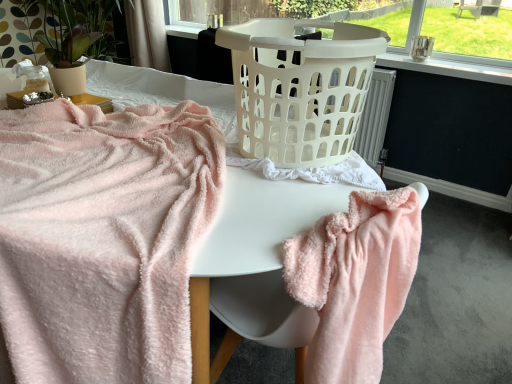
Measure the distance between point (318,376) and camera.

Point (318,376) and camera are 35.55 inches apart.

Locate an element on the screen. The image size is (512, 384). fluffy pink towel at lower right, placed as the second towel when sorted from left to right is located at coordinates (355, 281).

The image size is (512, 384). Describe the element at coordinates (147, 34) in the screenshot. I see `white sheer curtain at upper center` at that location.

The width and height of the screenshot is (512, 384). What are the coordinates of `soft pink plush towel at left, arranged as the second towel when viewed from the right` in the screenshot? It's located at (103, 238).

The width and height of the screenshot is (512, 384). Describe the element at coordinates (300, 88) in the screenshot. I see `white plastic laundry basket at center` at that location.

What do you see at coordinates (75, 29) in the screenshot?
I see `matte beige pot at upper left` at bounding box center [75, 29].

Locate an element on the screen. matte pink blanket at center is located at coordinates (264, 218).

Where is `white plastic laundry basket at center`? white plastic laundry basket at center is located at coordinates (259, 317).

From the image's perspective, is matte beige pot at upper left positioned above or below white plastic laundry basket at center?

matte beige pot at upper left is above white plastic laundry basket at center.

Is matte beige pot at upper left not near white plastic laundry basket at center?

Yes, matte beige pot at upper left and white plastic laundry basket at center are located far from each other.

From a real-world perspective, which object stands above the other?

matte beige pot at upper left.

Do you think white plastic laundry basket at center is within matte beige pot at upper left, or outside of it?

white plastic laundry basket at center is spatially situated outside matte beige pot at upper left.

Considering their positions, is white plastic laundry basket at center located in front of or behind matte beige pot at upper left?

Clearly, white plastic laundry basket at center is in front of matte beige pot at upper left.

Between white plastic laundry basket at center and matte beige pot at upper left, which one appears on the right side from the viewer's perspective?

white plastic laundry basket at center.

From the image's perspective, which one is positioned lower, white plastic laundry basket at center or matte beige pot at upper left?

white plastic laundry basket at center appears lower in the image.

Consider the image. From a real-world perspective, relative to fluffy pink towel at lower right, which appears as the 1th towel when viewed from the right, is white plastic laundry basket at upper center vertically above or below?

white plastic laundry basket at upper center is above fluffy pink towel at lower right, which appears as the 1th towel when viewed from the right.

How distant is white plastic laundry basket at upper center from fluffy pink towel at lower right, placed as the second towel when sorted from left to right?

1.92 meters.

How many degrees apart are the facing directions of white plastic laundry basket at upper center and fluffy pink towel at lower right, which appears as the 1th towel when viewed from the right?

86.2 degrees.

Considering the positions of objects white plastic laundry basket at upper center and fluffy pink towel at lower right, placed as the second towel when sorted from left to right, in the image provided, who is behind, white plastic laundry basket at upper center or fluffy pink towel at lower right, placed as the second towel when sorted from left to right,?

white plastic laundry basket at upper center is behind.

Does matte pink blanket at center appear on the right side of white plastic laundry basket at upper center?

No.

Does matte pink blanket at center have a smaller size compared to white plastic laundry basket at upper center?

Actually, matte pink blanket at center might be larger than white plastic laundry basket at upper center.

Is matte pink blanket at center next to white plastic laundry basket at upper center and touching it?

matte pink blanket at center is not next to white plastic laundry basket at upper center, and they're not touching.

In the scene shown: From the image's perspective, between soft pink plush towel at left, arranged as the second towel when viewed from the right, and fluffy pink towel at lower right, placed as the second towel when sorted from left to right, which one is located above?

From the image's view, soft pink plush towel at left, arranged as the second towel when viewed from the right, is above.

Where is `towel behind the fluffy pink towel at lower right, which appears as the 1th towel when viewed from the right`? towel behind the fluffy pink towel at lower right, which appears as the 1th towel when viewed from the right is located at coordinates (103, 238).

Is soft pink plush towel at left, acting as the 1th towel starting from the left, to the right of fluffy pink towel at lower right, placed as the second towel when sorted from left to right, from the viewer's perspective?

No.

From a real-world perspective, is soft pink plush towel at left, acting as the 1th towel starting from the left, above or below fluffy pink towel at lower right, which appears as the 1th towel when viewed from the right?

From a real-world perspective, soft pink plush towel at left, acting as the 1th towel starting from the left, is physically above fluffy pink towel at lower right, which appears as the 1th towel when viewed from the right.

Is point (149, 4) farther from camera compared to point (221, 266)?

That is True.

Which of these two, white sheer curtain at upper center or matte pink blanket at center, is smaller?

With smaller size is white sheer curtain at upper center.

Is white sheer curtain at upper center taller than matte pink blanket at center?

No.

I want to click on curtain lying on the left of matte pink blanket at center, so click(147, 34).

Could you tell me if white plastic laundry basket at center is turned towards matte pink blanket at center?

No, white plastic laundry basket at center is not oriented towards matte pink blanket at center.

Is point (368, 30) less distant than point (304, 202)?

No.

Is the depth of white plastic laundry basket at center less than that of matte pink blanket at center?

No, it is not.

From the image's perspective, is white plastic laundry basket at center under matte pink blanket at center?

No, from the image's perspective, white plastic laundry basket at center is not below matte pink blanket at center.

Find the location of a particular element. This screenshot has width=512, height=384. round table below the matte beige pot at upper left (from a real-world perspective) is located at coordinates (259, 317).

Where is `plant that is above the white plastic laundry basket at center (from a real-world perspective)`? The width and height of the screenshot is (512, 384). plant that is above the white plastic laundry basket at center (from a real-world perspective) is located at coordinates (75, 29).

When comparing their distances from white plastic laundry basket at center, does fluffy pink towel at lower right, which appears as the 1th towel when viewed from the right, or matte beige pot at upper left seem further?

Among the two, matte beige pot at upper left is located further to white plastic laundry basket at center.

Based on their spatial positions, is soft pink plush towel at left, acting as the 1th towel starting from the left, or matte pink blanket at center closer to white sheer curtain at upper center?

Based on the image, matte pink blanket at center appears to be nearer to white sheer curtain at upper center.

From the image, which object appears to be nearer to white sheer curtain at upper center, matte pink blanket at center or white plastic laundry basket at center?

matte pink blanket at center is positioned closer to the anchor white sheer curtain at upper center.

When comparing their distances from matte beige pot at upper left, does white plastic laundry basket at center or white plastic laundry basket at center seem closer?

white plastic laundry basket at center is closer to matte beige pot at upper left.

From the picture: Which object lies further to the anchor point white sheer curtain at upper center, white plastic laundry basket at center or matte beige pot at upper left?

white plastic laundry basket at center is further to white sheer curtain at upper center.

When comparing their distances from white sheer curtain at upper center, does white plastic laundry basket at upper center or matte beige pot at upper left seem closer?

The object closer to white sheer curtain at upper center is matte beige pot at upper left.

Based on their spatial positions, is soft pink plush towel at left, acting as the 1th towel starting from the left, or white plastic laundry basket at upper center closer to white plastic laundry basket at center?

soft pink plush towel at left, acting as the 1th towel starting from the left, is positioned closer to the anchor white plastic laundry basket at center.

Based on their spatial positions, is white sheer curtain at upper center or fluffy pink towel at lower right, which appears as the 1th towel when viewed from the right, closer to white plastic laundry basket at center?

Among the two, fluffy pink towel at lower right, which appears as the 1th towel when viewed from the right, is located nearer to white plastic laundry basket at center.

Image resolution: width=512 pixels, height=384 pixels. I want to click on basket container located between soft pink plush towel at left, arranged as the second towel when viewed from the right, and white sheer curtain at upper center in the depth direction, so click(x=300, y=88).

At what (x,y) coordinates should I click in order to perform the action: click on basket container located between soft pink plush towel at left, arranged as the second towel when viewed from the right, and fluffy pink towel at lower right, placed as the second towel when sorted from left to right, in the left-right direction. Please return your answer as a coordinate pair (x, y). The height and width of the screenshot is (384, 512). Looking at the image, I should click on (300, 88).

This screenshot has width=512, height=384. Identify the location of bay window located between soft pink plush towel at left, acting as the 1th towel starting from the left, and white sheer curtain at upper center in the depth direction. (448, 67).

Find the location of `basket container located between fluffy pink towel at lower right, which appears as the 1th towel when viewed from the right, and white sheer curtain at upper center in the depth direction`. basket container located between fluffy pink towel at lower right, which appears as the 1th towel when viewed from the right, and white sheer curtain at upper center in the depth direction is located at coordinates (300, 88).